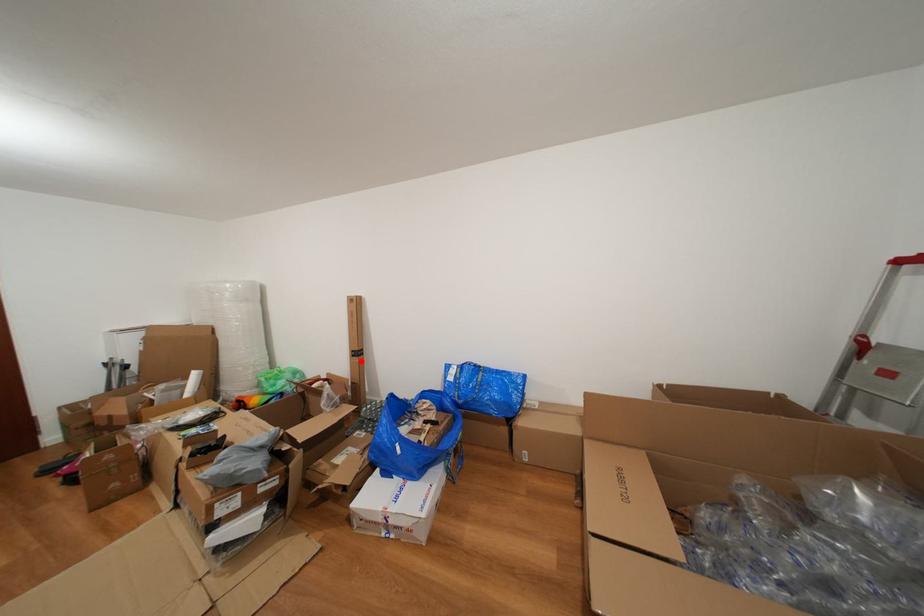
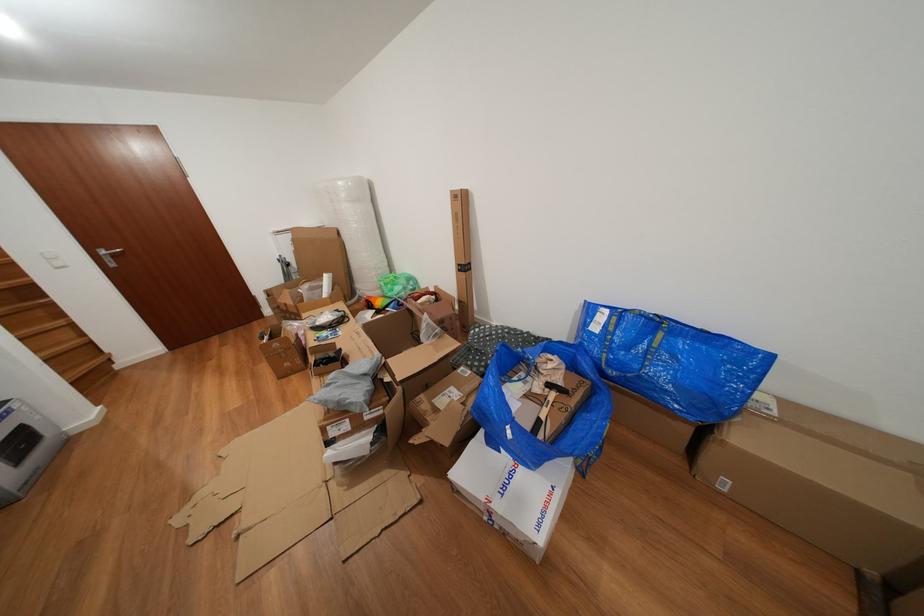
Locate, in the second image, the point that corresponds to the highlighted location in the first image.

(468, 276)